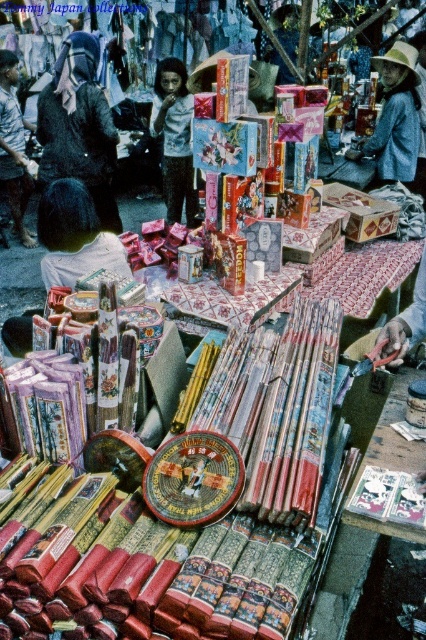
Question: Does blue denim jacket at upper right have a smaller size compared to light blue shirt at center?

Choices:
 (A) no
 (B) yes

Answer: (A)

Question: Which is farther from the dark brown leather jacket at upper left?

Choices:
 (A) blue denim jacket at upper right
 (B) light blue shirt at center

Answer: (A)

Question: Which point is closer to the camera?

Choices:
 (A) light blue shirt at center
 (B) blue denim jacket at upper right
 (C) dark blue fabric at center
 (D) dark brown leather jacket at upper left

Answer: (D)

Question: Can you confirm if blue denim jacket at upper right is positioned below light blue shirt at center?

Choices:
 (A) no
 (B) yes

Answer: (B)

Question: Which point is closer to the camera?

Choices:
 (A) dark blue fabric at center
 (B) dark brown leather jacket at upper left

Answer: (B)

Question: Is light blue shirt at center thinner than dark blue fabric at center?

Choices:
 (A) yes
 (B) no

Answer: (A)